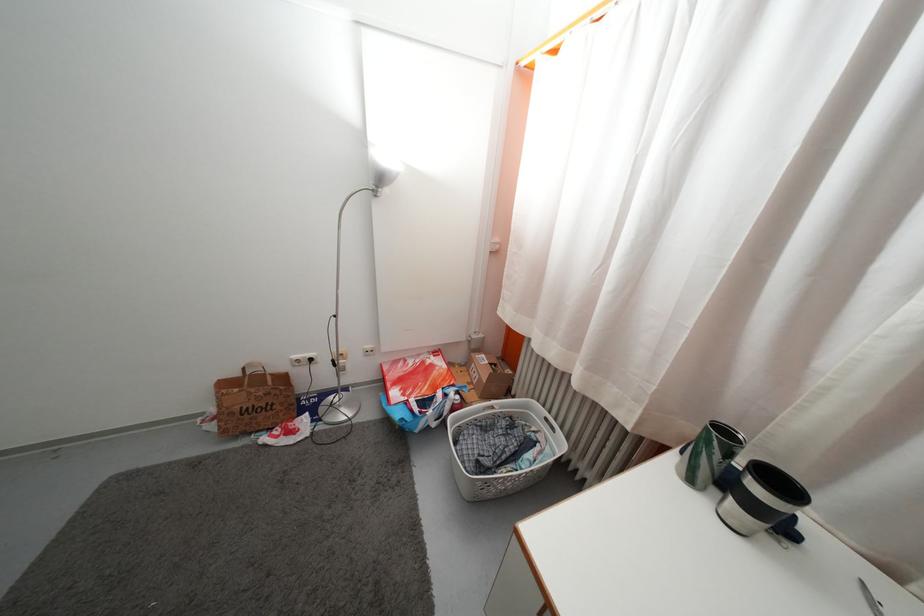
The width and height of the screenshot is (924, 616). Find the location of `laundry basket handle`. laundry basket handle is located at coordinates pyautogui.click(x=488, y=408).